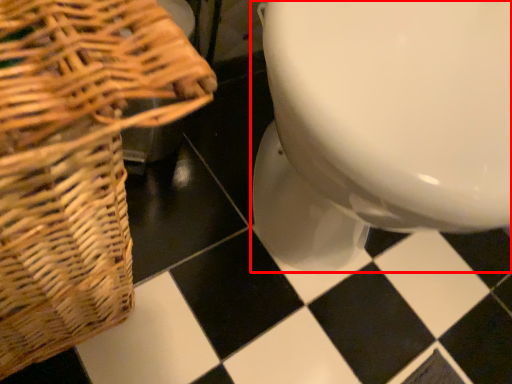
Question: Considering the relative positions of toilet (annotated by the red box) and picnic basket in the image provided, where is toilet (annotated by the red box) located with respect to the staircase?

Choices:
 (A) right
 (B) left

Answer: (A)